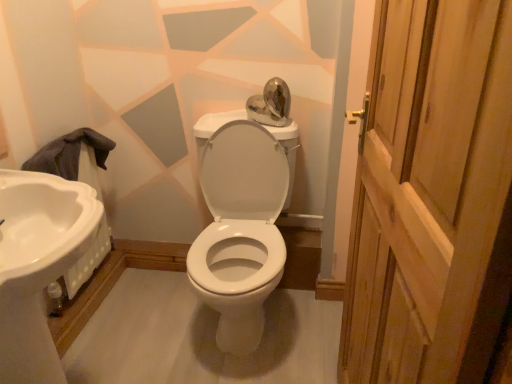
In order to face white glossy porcelain at center, should I rotate leftwards or rightwards?

You should look left and rotate roughly 2.514 degrees.

Describe the element at coordinates (37, 264) in the screenshot. The width and height of the screenshot is (512, 384). I see `white glossy sink at left` at that location.

Identify the location of wooden door at right. This screenshot has width=512, height=384. (431, 196).

Image resolution: width=512 pixels, height=384 pixels. In order to click on white glossy porcelain at center in this screenshot , I will do `click(240, 230)`.

Considering the relative sizes of white glossy porcelain at center and white glossy sink at left in the image provided, is white glossy porcelain at center thinner than white glossy sink at left?

No, white glossy porcelain at center is not thinner than white glossy sink at left.

Is white glossy porcelain at center facing away from white glossy sink at left?

No, white glossy porcelain at center is not facing away from white glossy sink at left.

Find the location of `porcelain lying on the right of white glossy sink at left`. porcelain lying on the right of white glossy sink at left is located at coordinates (240, 230).

How different are the orientations of white glossy porcelain at center and white glossy sink at left in degrees?

The angular difference between white glossy porcelain at center and white glossy sink at left is 90 degrees.

How different are the orientations of wooden door at right and white glossy sink at left in degrees?

The angle between the facing direction of wooden door at right and the facing direction of white glossy sink at left is 175 degrees.

Between wooden door at right and white glossy sink at left, which one has smaller size?

wooden door at right.

Which object is further away from the camera taking this photo, wooden door at right or white glossy sink at left?

white glossy sink at left is more distant.

Could you tell me if wooden door at right is facing white glossy sink at left?

Yes.

Who is shorter, wooden door at right or white glossy porcelain at center?

A: With less height is white glossy porcelain at center.

Is wooden door at right aimed at white glossy porcelain at center?

No, wooden door at right is not aimed at white glossy porcelain at center.

Considering the points (389, 62) and (240, 274), which point is in front, point (389, 62) or point (240, 274)?

The point (389, 62) is closer.

Considering the positions of objects wooden door at right and white glossy porcelain at center in the image provided, who is more to the right, wooden door at right or white glossy porcelain at center?

Positioned to the right is wooden door at right.

Is point (219, 268) closer or farther from the camera than point (484, 254)?

Clearly, point (219, 268) is more distant from the camera than point (484, 254).

From the image's perspective, which object appears higher, white glossy porcelain at center or wooden door at right?

white glossy porcelain at center, from the image's perspective.

Is white glossy porcelain at center positioned beyond the bounds of wooden door at right?

Yes.

Looking at their sizes, would you say white glossy porcelain at center is wider or thinner than wooden door at right?

white glossy porcelain at center is wider than wooden door at right.

Is the position of white glossy sink at left more distant than that of white glossy porcelain at center?

No.

Is white glossy sink at left located outside white glossy porcelain at center?

Yes.

Which of these two, white glossy sink at left or white glossy porcelain at center, is bigger?

With larger size is white glossy porcelain at center.

Who is shorter, white glossy sink at left or wooden door at right?

white glossy sink at left is shorter.

Is white glossy sink at left surrounding wooden door at right?

→ No.

Is white glossy sink at left oriented towards wooden door at right?

Yes, white glossy sink at left is turned towards wooden door at right.

Can you tell me how much white glossy sink at left and wooden door at right differ in facing direction?

white glossy sink at left and wooden door at right are facing 175 degrees away from each other.

At what (x,y) coordinates should I click in order to perform the action: click on porcelain that appears behind the white glossy sink at left. Please return your answer as a coordinate pair (x, y). This screenshot has height=384, width=512. Looking at the image, I should click on (240, 230).

In order to click on sink lying below the wooden door at right (from the image's perspective) in this screenshot , I will do `click(37, 264)`.

When comparing their distances from white glossy porcelain at center, does white glossy sink at left or wooden door at right seem closer?

white glossy sink at left lies closer to white glossy porcelain at center than the other object.

Considering their positions, is wooden door at right positioned closer to white glossy porcelain at center than white glossy sink at left?

white glossy sink at left is positioned closer to the anchor white glossy porcelain at center.

Considering their positions, is wooden door at right positioned closer to white glossy sink at left than white glossy porcelain at center?

white glossy porcelain at center lies closer to white glossy sink at left than the other object.

Which object lies further to the anchor point wooden door at right, white glossy sink at left or white glossy porcelain at center?

white glossy sink at left.

Estimate the real-world distances between objects in this image. Which object is further from white glossy sink at left, white glossy porcelain at center or wooden door at right?

wooden door at right.

Based on their spatial positions, is white glossy porcelain at center or white glossy sink at left further from wooden door at right?

Based on the image, white glossy sink at left appears to be further to wooden door at right.

Image resolution: width=512 pixels, height=384 pixels. What are the coordinates of `porcelain between white glossy sink at left and wooden door at right in the horizontal direction` in the screenshot? It's located at (240, 230).